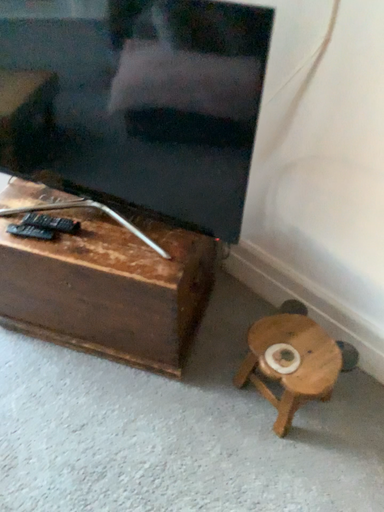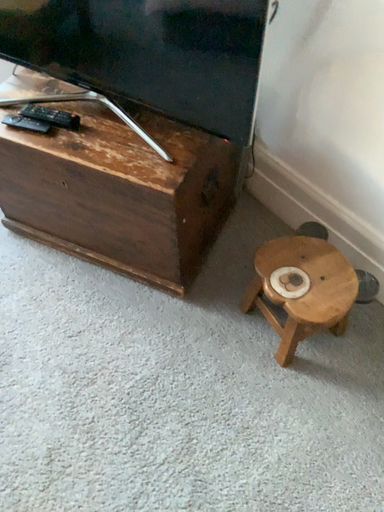
Question: How did the camera likely rotate when shooting the video?

Choices:
 (A) rotated right
 (B) rotated left

Answer: (B)